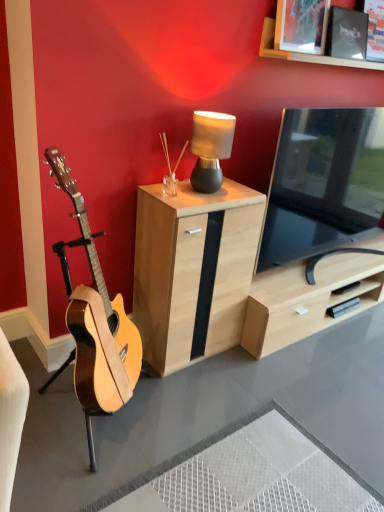
Locate an element on the screen. spots to the right of light wood cabinet at center is located at coordinates (266, 370).